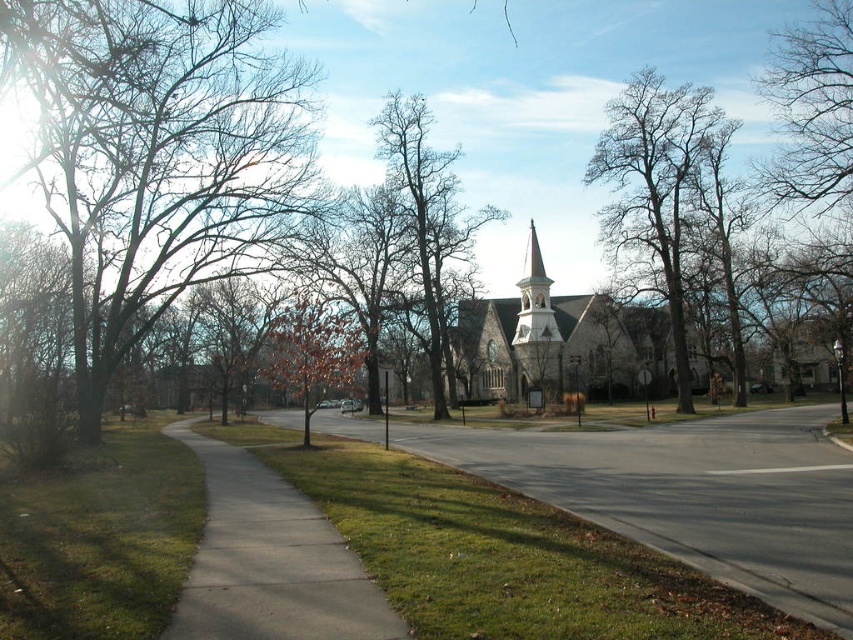
Question: Which point is farther from the camera taking this photo?

Choices:
 (A) (523, 332)
 (B) (161, 44)

Answer: (A)

Question: Can you confirm if gray asphalt sidewalk at center is smaller than stone church at center?

Choices:
 (A) yes
 (B) no

Answer: (A)

Question: Is bare wood tree at center in front of brown leafy tree at center?

Choices:
 (A) no
 (B) yes

Answer: (A)

Question: Which point is farther from the camera taking this photo?

Choices:
 (A) (207, 81)
 (B) (195, 618)
 (C) (630, 109)
 (D) (587, 381)

Answer: (D)

Question: Which point is closer to the camera?

Choices:
 (A) (543, 285)
 (B) (453, 292)

Answer: (B)

Question: Is bare wood tree at center smaller than brown leafy tree at center?

Choices:
 (A) no
 (B) yes

Answer: (A)